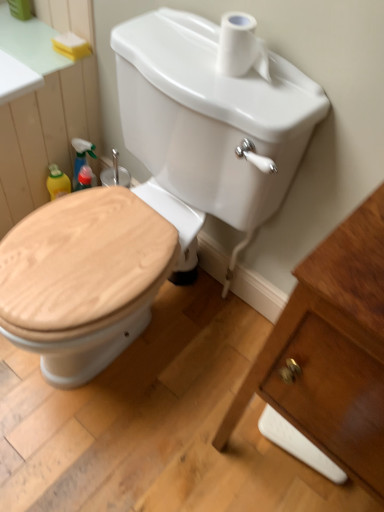
Question: From a real-world perspective, is white matte toilet paper at upper center positioned above or below wooden toilet seat at center?

Choices:
 (A) below
 (B) above

Answer: (B)

Question: Is white matte toilet paper at upper center situated inside wooden toilet seat at center or outside?

Choices:
 (A) inside
 (B) outside

Answer: (B)

Question: Estimate the real-world distances between objects in this image. Which object is farther from the yellow sponge at upper left?

Choices:
 (A) white glossy porcelain at right
 (B) wooden toilet seat at center
 (C) white matte toilet paper at upper center

Answer: (A)

Question: Considering the real-world distances, which object is closest to the white matte toilet paper at upper center?

Choices:
 (A) white glossy porcelain at right
 (B) yellow sponge at upper left
 (C) wooden toilet seat at center

Answer: (C)